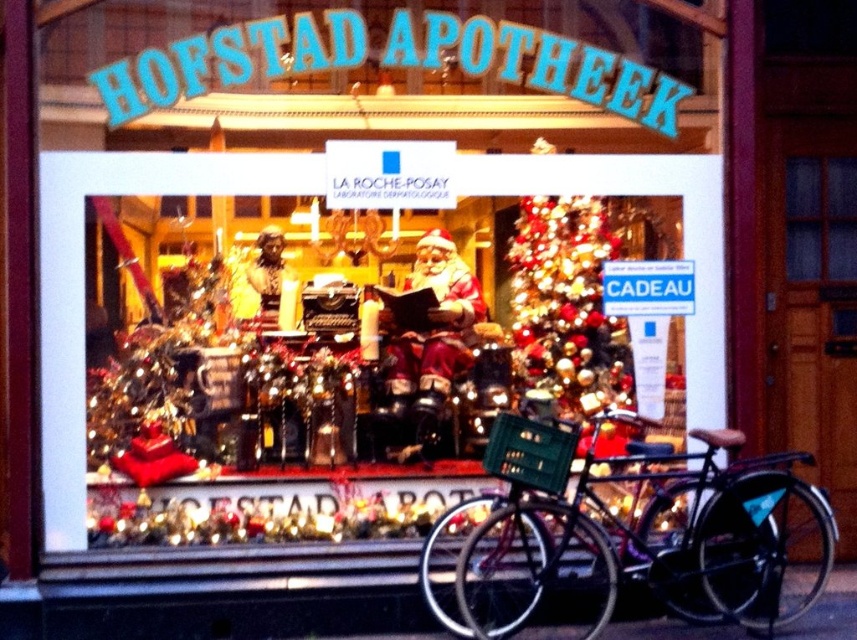
Does point (560, 522) come behind point (573, 355)?

That is False.

Between point (750, 493) and point (553, 352), which one is positioned in front?

Positioned in front is point (750, 493).

Does point (499, 445) come closer to viewer compared to point (516, 326)?

Yes, point (499, 445) is closer to viewer.

Locate an element on the screen. The width and height of the screenshot is (857, 640). black matte bicycle at lower right is located at coordinates (639, 534).

Who is more forward, (757, 518) or (787, 196)?

Point (757, 518) is in front.

Does black matte bicycle at lower right lie behind clear glass window at upper right?

No, it is not.

This screenshot has height=640, width=857. In order to click on black matte bicycle at lower right in this screenshot , I will do `click(639, 534)`.

The height and width of the screenshot is (640, 857). In order to click on black matte bicycle at lower right in this screenshot , I will do `click(639, 534)`.

Describe the element at coordinates (566, 301) in the screenshot. I see `shiny gold ornaments at center` at that location.

Can you confirm if shiny gold ornaments at center is positioned below clear glass window at upper right?

Correct, shiny gold ornaments at center is located below clear glass window at upper right.

The width and height of the screenshot is (857, 640). What do you see at coordinates (566, 301) in the screenshot?
I see `shiny gold ornaments at center` at bounding box center [566, 301].

Where is `shiny gold ornaments at center`? shiny gold ornaments at center is located at coordinates (566, 301).